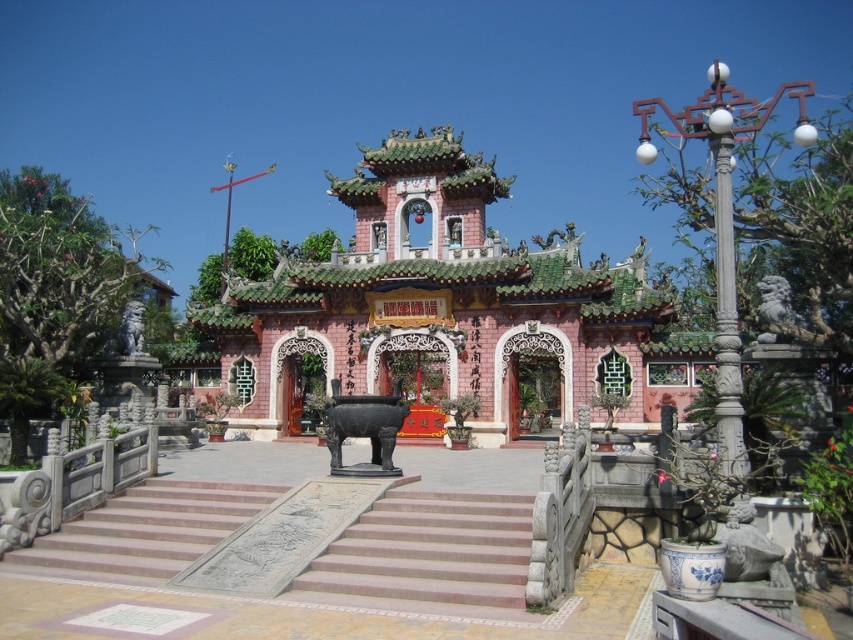
Question: Is smooth stone stairs at center to the left of white carved stone pillar at right from the viewer's perspective?

Choices:
 (A) yes
 (B) no

Answer: (A)

Question: Does pink stone temple at center have a lesser width compared to white carved stone pillar at right?

Choices:
 (A) yes
 (B) no

Answer: (B)

Question: Which point is farther to the camera?

Choices:
 (A) pink stone temple at center
 (B) white carved stone pillar at right
 (C) black polished elephant at center
 (D) smooth stone stairs at center

Answer: (A)

Question: Among these objects, which one is farthest from the camera?

Choices:
 (A) black polished elephant at center
 (B) white carved stone pillar at right
 (C) smooth stone stairs at center
 (D) pink stone temple at center

Answer: (D)

Question: Is pink stone temple at center to the right of smooth stone stairs at center from the viewer's perspective?

Choices:
 (A) yes
 (B) no

Answer: (B)

Question: Among these points, which one is nearest to the camera?

Choices:
 (A) (393, 323)
 (B) (329, 451)
 (C) (341, 564)

Answer: (C)